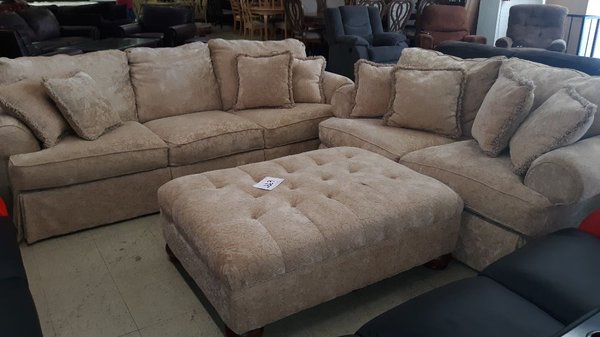
Identify the location of ottoman shadow. (340, 302).